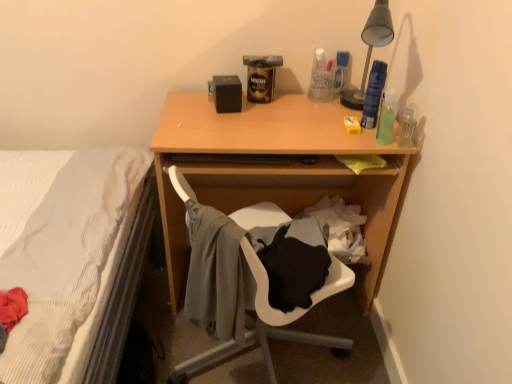
The height and width of the screenshot is (384, 512). In order to click on vacant space in between clear plastic bottle at right, the second bottle from the front, and black matte speaker at upper center in this screenshot , I will do `click(300, 119)`.